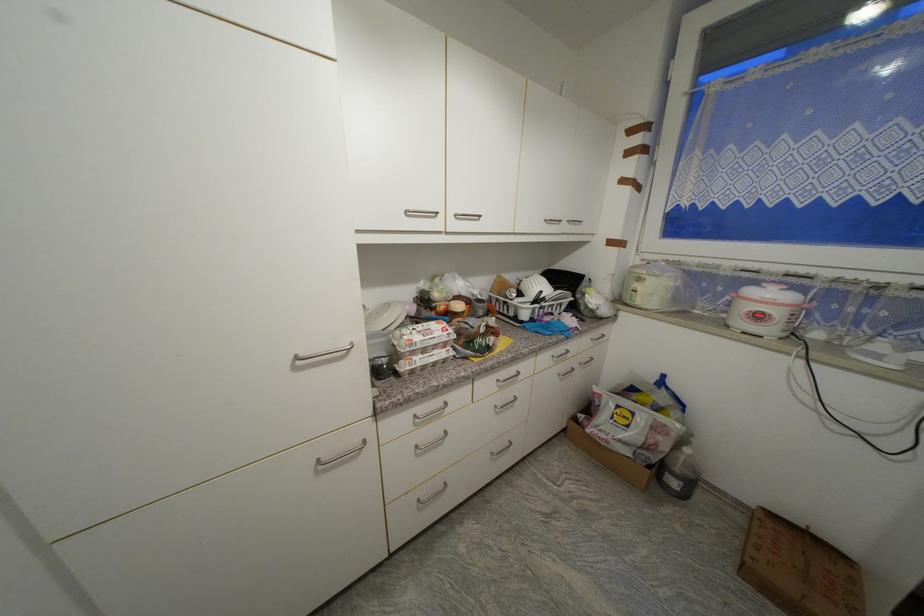
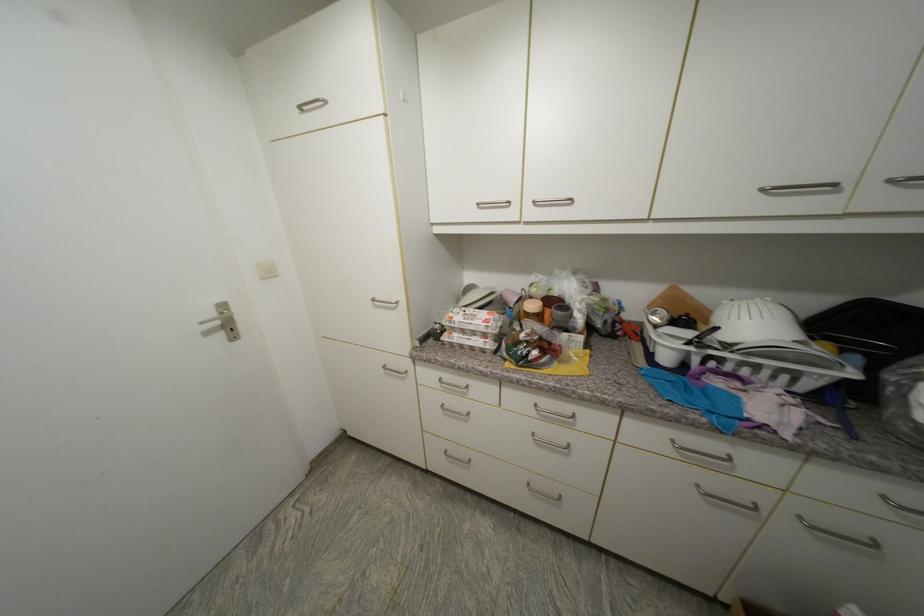
Question: The camera is either moving clockwise (left) or counter-clockwise (right) around the object. The first image is from the beginning of the video and the second image is from the end. Is the camera moving left or right when shooting the video?

Choices:
 (A) Left
 (B) Right

Answer: (B)